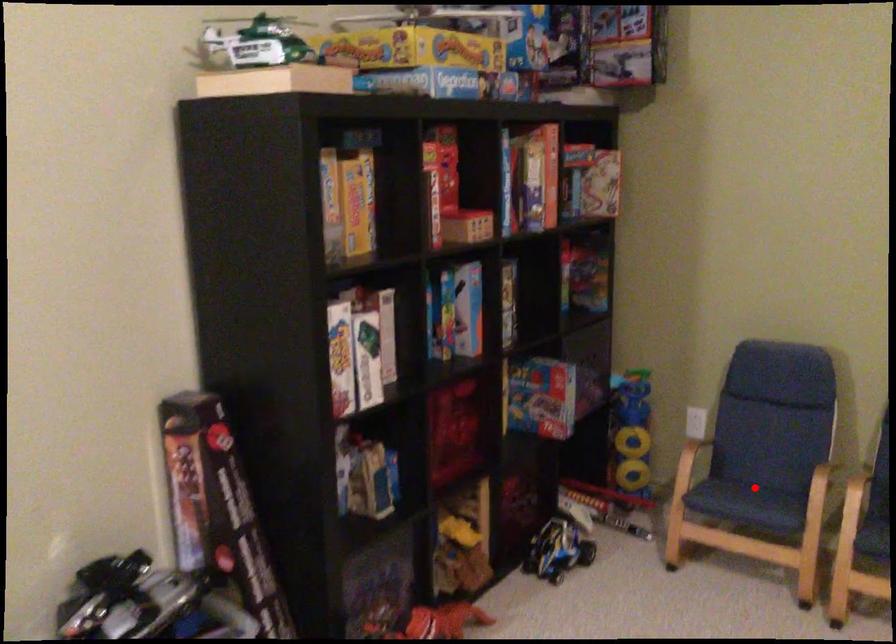
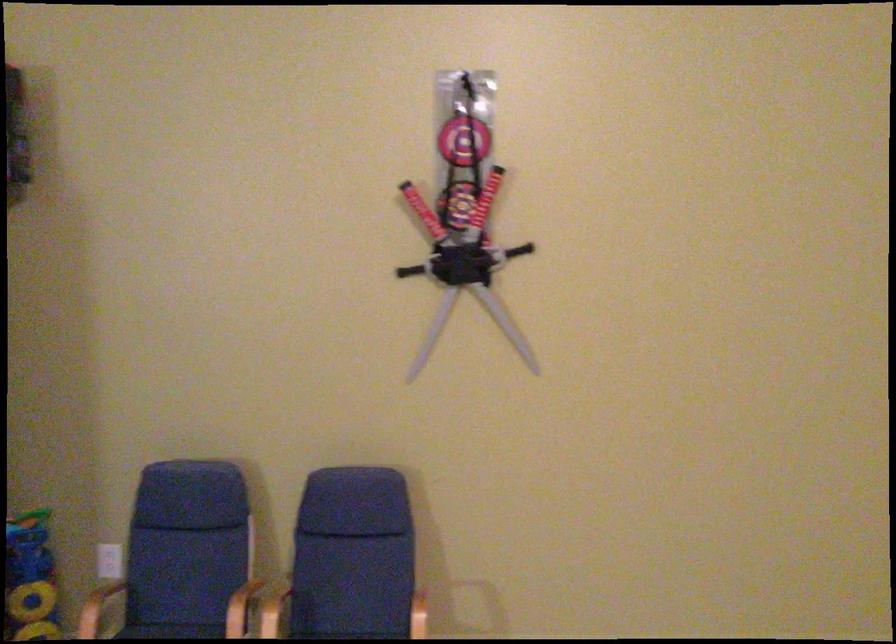
In the second image, find the point that corresponds to the highlighted location in the first image.

(169, 630)